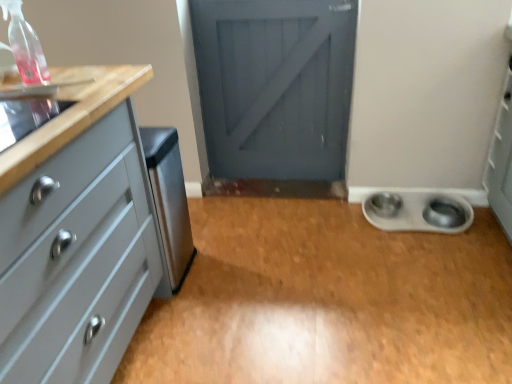
Question: Is clear plastic spray bottle at upper left completely or partially inside metallic silver bowl at lower right?

Choices:
 (A) yes
 (B) no

Answer: (B)

Question: Considering the relative sizes of metallic silver bowl at lower right and clear plastic spray bottle at upper left in the image provided, is metallic silver bowl at lower right shorter than clear plastic spray bottle at upper left?

Choices:
 (A) no
 (B) yes

Answer: (B)

Question: Considering the relative sizes of metallic silver bowl at lower right and clear plastic spray bottle at upper left in the image provided, is metallic silver bowl at lower right smaller than clear plastic spray bottle at upper left?

Choices:
 (A) yes
 (B) no

Answer: (A)

Question: Can you confirm if metallic silver bowl at lower right is positioned to the left of clear plastic spray bottle at upper left?

Choices:
 (A) yes
 (B) no

Answer: (B)

Question: Is metallic silver bowl at lower right looking in the opposite direction of clear plastic spray bottle at upper left?

Choices:
 (A) no
 (B) yes

Answer: (A)

Question: Considering the positions of point (379, 208) and point (42, 82), is point (379, 208) closer or farther from the camera than point (42, 82)?

Choices:
 (A) closer
 (B) farther

Answer: (B)

Question: In the image, is metallic silver bowl at lower right on the left side or the right side of clear plastic spray bottle at upper left?

Choices:
 (A) left
 (B) right

Answer: (B)

Question: From the image's perspective, is metallic silver bowl at lower right above or below clear plastic spray bottle at upper left?

Choices:
 (A) below
 (B) above

Answer: (A)

Question: From a real-world perspective, is metallic silver bowl at lower right physically located above or below clear plastic spray bottle at upper left?

Choices:
 (A) above
 (B) below

Answer: (B)

Question: Relative to silver metallic bowls at lower right, which ranks as the 1th appliance in right-to-left order, is clear plastic spray bottle at upper left in front or behind?

Choices:
 (A) behind
 (B) front

Answer: (B)

Question: Is clear plastic spray bottle at upper left bigger or smaller than silver metallic bowls at lower right, arranged as the second appliance when viewed from the front?

Choices:
 (A) big
 (B) small

Answer: (B)

Question: Choose the correct answer: Is clear plastic spray bottle at upper left inside silver metallic bowls at lower right, acting as the second appliance starting from the left, or outside it?

Choices:
 (A) inside
 (B) outside

Answer: (B)

Question: Would you say clear plastic spray bottle at upper left is to the left or to the right of silver metallic bowls at lower right, which ranks as the 1th appliance in right-to-left order, in the picture?

Choices:
 (A) left
 (B) right

Answer: (A)

Question: Choose the correct answer: Is metallic silver bowls at lower right inside matte gray chest of drawers at left or outside it?

Choices:
 (A) inside
 (B) outside

Answer: (B)

Question: Looking at their shapes, would you say metallic silver bowls at lower right is wider or thinner than matte gray chest of drawers at left?

Choices:
 (A) wide
 (B) thin

Answer: (A)